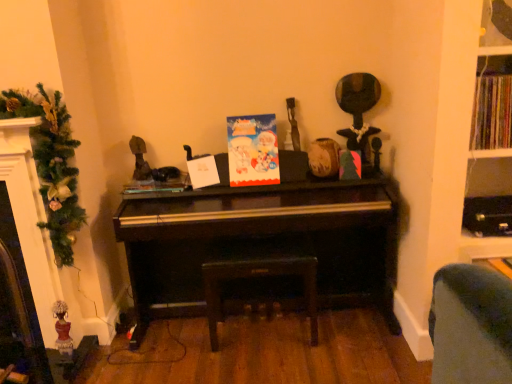
Describe the element at coordinates (492, 113) in the screenshot. The width and height of the screenshot is (512, 384). I see `multicolored paper book at upper right` at that location.

Identify the location of matte paper card at center. This screenshot has width=512, height=384. (253, 150).

What do you see at coordinates (51, 164) in the screenshot?
I see `green textured garland at left` at bounding box center [51, 164].

This screenshot has width=512, height=384. Describe the element at coordinates (263, 240) in the screenshot. I see `shiny black piano at center` at that location.

Locate an element on the screen. The height and width of the screenshot is (384, 512). leather-like dark brown stool at center is located at coordinates (259, 276).

Would you say leather-like dark brown stool at center is inside or outside matte paper card at center?

leather-like dark brown stool at center is spatially situated outside matte paper card at center.

Find the location of `christmas card located above the leather-like dark brown stool at center (from the image's perspective)`. christmas card located above the leather-like dark brown stool at center (from the image's perspective) is located at coordinates (253, 150).

Is leather-like dark brown stool at center taller or shorter than matte paper card at center?

leather-like dark brown stool at center is taller than matte paper card at center.

Consider the image. Which object is closer to the camera taking this photo, leather-like dark brown stool at center or matte paper card at center?

leather-like dark brown stool at center is more forward.

I want to click on stool lying behind the shiny black piano at center, so click(259, 276).

Does point (204, 277) come behind point (321, 226)?

That is True.

Considering the positions of objects leather-like dark brown stool at center and shiny black piano at center in the image provided, who is more to the left, leather-like dark brown stool at center or shiny black piano at center?

leather-like dark brown stool at center.

Where is `book located on the right of leather-like dark brown stool at center`? This screenshot has height=384, width=512. book located on the right of leather-like dark brown stool at center is located at coordinates (492, 113).

Is point (487, 122) behind point (273, 260)?

No, (487, 122) is closer to viewer.

From the image's perspective, who appears lower, multicolored paper book at upper right or leather-like dark brown stool at center?

From the image's view, leather-like dark brown stool at center is below.

Between multicolored paper book at upper right and leather-like dark brown stool at center, which one has smaller size?

Smaller between the two is multicolored paper book at upper right.

Based on the photo, is green textured garland at left thinner than matte paper card at center?

In fact, green textured garland at left might be wider than matte paper card at center.

Is green textured garland at left aimed at matte paper card at center?

No.

Locate an element on the screen. This screenshot has height=384, width=512. christmas card located on the right of green textured garland at left is located at coordinates (253, 150).

Is green textured garland at left in contact with matte paper card at center?

No, green textured garland at left is not with matte paper card at center.

Does point (387, 253) appear closer or farther from the camera than point (38, 174)?

Point (387, 253) is positioned farther from the camera compared to point (38, 174).

Does shiny black piano at center have a lesser width compared to green textured garland at left?

No.

Is shiny black piano at center facing away from green textured garland at left?

That's not correct — shiny black piano at center is not looking away from green textured garland at left.

What are the coordinates of `christmas tree lying on the left of shiny black piano at center` in the screenshot? It's located at (51, 164).

Between matte paper card at center and shiny black piano at center, which one is positioned behind?

matte paper card at center is further from the camera.

Are matte paper card at center and shiny black piano at center far apart?

matte paper card at center is actually quite close to shiny black piano at center.

Who is smaller, matte paper card at center or shiny black piano at center?

Smaller between the two is matte paper card at center.

Considering the positions of objects matte paper card at center and leather-like dark brown stool at center in the image provided, who is more to the left, matte paper card at center or leather-like dark brown stool at center?

Positioned to the left is leather-like dark brown stool at center.

Does matte paper card at center come behind leather-like dark brown stool at center?

Yes, it is.

Is leather-like dark brown stool at center located within matte paper card at center?

No.

Considering the sizes of matte paper card at center and leather-like dark brown stool at center in the image, is matte paper card at center wider or thinner than leather-like dark brown stool at center?

matte paper card at center is thinner than leather-like dark brown stool at center.

At what (x,y) coordinates should I click in order to perform the action: click on stool in front of the matte paper card at center. Please return your answer as a coordinate pair (x, y). The height and width of the screenshot is (384, 512). Looking at the image, I should click on (259, 276).

This screenshot has height=384, width=512. Identify the location of piano lying on the right of leather-like dark brown stool at center. (263, 240).

Estimate the real-world distances between objects in this image. Which object is closer to shiny black piano at center, leather-like dark brown stool at center or multicolored paper book at upper right?

Based on the image, leather-like dark brown stool at center appears to be nearer to shiny black piano at center.

Looking at the image, which one is located closer to green textured garland at left, matte paper card at center or leather-like dark brown stool at center?

matte paper card at center is closer to green textured garland at left.

From the image, which object appears to be nearer to shiny black piano at center, matte paper card at center or multicolored paper book at upper right?

matte paper card at center is closer to shiny black piano at center.

Which object lies further to the anchor point matte paper card at center, shiny black piano at center or leather-like dark brown stool at center?

leather-like dark brown stool at center lies further to matte paper card at center than the other object.

Considering their positions, is leather-like dark brown stool at center positioned further to shiny black piano at center than matte paper card at center?

The object further to shiny black piano at center is matte paper card at center.

Estimate the real-world distances between objects in this image. Which object is further from multicolored paper book at upper right, green textured garland at left or shiny black piano at center?

Among the two, green textured garland at left is located further to multicolored paper book at upper right.

From the image, which object appears to be farther from multicolored paper book at upper right, shiny black piano at center or matte paper card at center?

The object further to multicolored paper book at upper right is matte paper card at center.

From the image, which object appears to be farther from shiny black piano at center, multicolored paper book at upper right or leather-like dark brown stool at center?

Based on the image, multicolored paper book at upper right appears to be further to shiny black piano at center.

This screenshot has height=384, width=512. Identify the location of stool between green textured garland at left and multicolored paper book at upper right. (259, 276).

Where is `christmas card between green textured garland at left and shiny black piano at center from left to right`? The height and width of the screenshot is (384, 512). christmas card between green textured garland at left and shiny black piano at center from left to right is located at coordinates (253, 150).

At what (x,y) coordinates should I click in order to perform the action: click on piano between matte paper card at center and leather-like dark brown stool at center in the up-down direction. Please return your answer as a coordinate pair (x, y). This screenshot has height=384, width=512. Looking at the image, I should click on (263, 240).

The height and width of the screenshot is (384, 512). I want to click on piano between matte paper card at center and multicolored paper book at upper right from left to right, so click(263, 240).